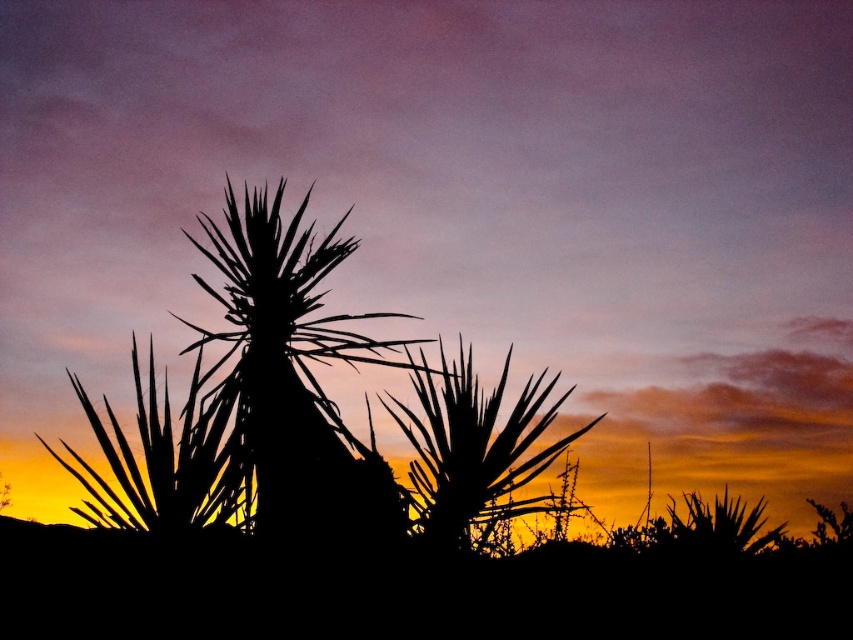
You are an artist trying to paint the desert scene. You want to ensure the black spiky plant at center and the silhouette leafy plant at center are proportionally accurate. Which plant should you draw larger?

The black spiky plant at center should be drawn larger since it has a larger size compared to the silhouette leafy plant at center according to the description.

You are standing in the desert scene observing the sunset. There is a black spiky plant at center marked by point coordinates. Can you tell me what object is located at the coordinates point (x=294, y=380)?

The point (x=294, y=380) marks the black spiky plant at center.